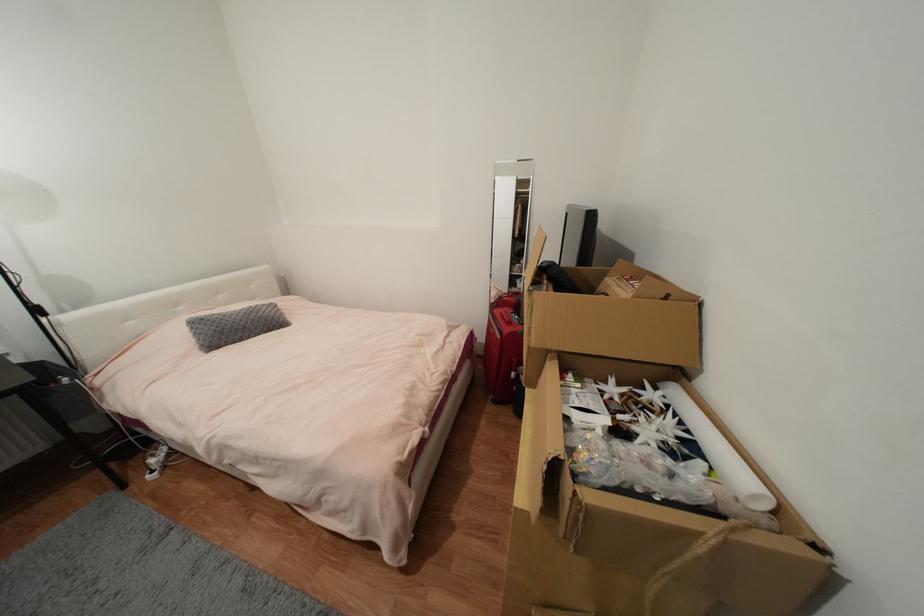
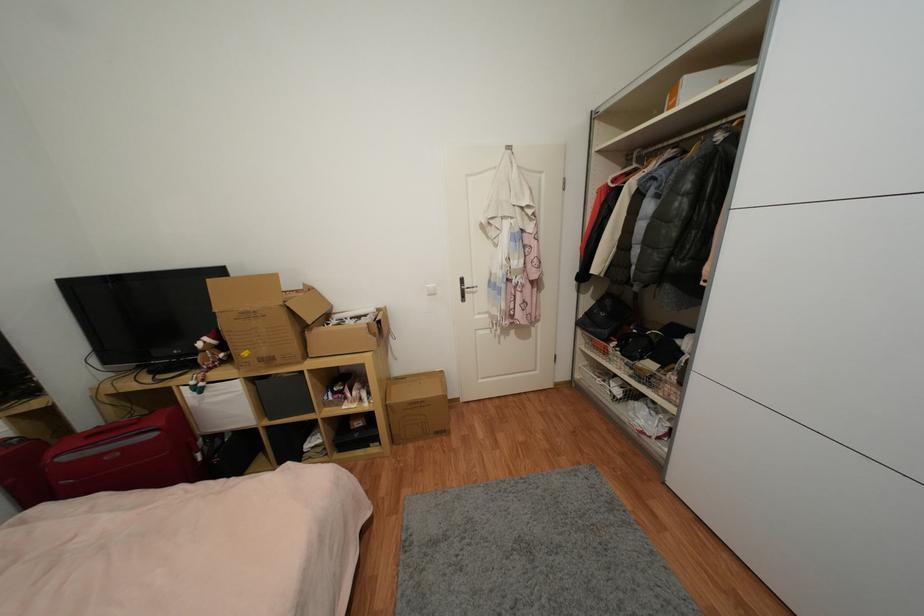
Locate, in the second image, the point that corresponds to the point at 503,338 in the first image.

(157, 436)